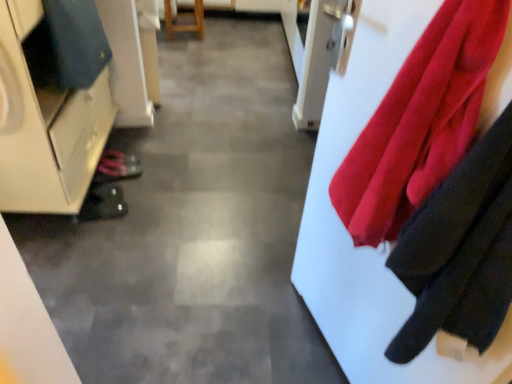
Question: Is shiny black shoe at lower left, the 1th shoe positioned from the top, not inside matte white cabinet at left?

Choices:
 (A) no
 (B) yes

Answer: (B)

Question: Is shiny black shoe at lower left, the 1th shoe positioned from the top, wider than matte white cabinet at left?

Choices:
 (A) no
 (B) yes

Answer: (A)

Question: Does shiny black shoe at lower left, placed as the 1th shoe when sorted from back to front, appear on the right side of matte white cabinet at left?

Choices:
 (A) no
 (B) yes

Answer: (B)

Question: Does shiny black shoe at lower left, the second shoe from the bottom, have a larger size compared to matte white cabinet at left?

Choices:
 (A) no
 (B) yes

Answer: (A)

Question: Is shiny black shoe at lower left, the 2th shoe from the front, further to camera compared to matte white cabinet at left?

Choices:
 (A) yes
 (B) no

Answer: (A)

Question: Considering the positions of point (96, 185) and point (55, 39), is point (96, 185) closer or farther from the camera than point (55, 39)?

Choices:
 (A) farther
 (B) closer

Answer: (A)

Question: From the image's perspective, is black rubber shoe at lower left, positioned as the 2th shoe in top-to-bottom order, located above or below dark blue fabric at left?

Choices:
 (A) above
 (B) below

Answer: (B)

Question: From a real-world perspective, is black rubber shoe at lower left, which ranks as the first shoe in bottom-to-top order, above or below dark blue fabric at left?

Choices:
 (A) below
 (B) above

Answer: (A)

Question: In the image, is black rubber shoe at lower left, the 2th shoe when ordered from back to front, on the left side or the right side of dark blue fabric at left?

Choices:
 (A) left
 (B) right

Answer: (B)

Question: Based on their positions, is wooden stool at center located to the left or right of black rubber shoe at lower left, the 2th shoe when ordered from back to front?

Choices:
 (A) left
 (B) right

Answer: (B)

Question: From the image's perspective, is wooden stool at center located above or below black rubber shoe at lower left, which ranks as the first shoe in bottom-to-top order?

Choices:
 (A) above
 (B) below

Answer: (A)

Question: Considering the positions of wooden stool at center and black rubber shoe at lower left, positioned as the 2th shoe in top-to-bottom order, in the image, is wooden stool at center bigger or smaller than black rubber shoe at lower left, positioned as the 2th shoe in top-to-bottom order,?

Choices:
 (A) big
 (B) small

Answer: (A)

Question: From a real-world perspective, is wooden stool at center above or below black rubber shoe at lower left, the 2th shoe when ordered from back to front?

Choices:
 (A) above
 (B) below

Answer: (A)

Question: From a real-world perspective, is velvety red cloth at right physically located above or below matte white cabinet at left?

Choices:
 (A) above
 (B) below

Answer: (A)

Question: Visually, is velvety red cloth at right positioned to the left or to the right of matte white cabinet at left?

Choices:
 (A) left
 (B) right

Answer: (B)